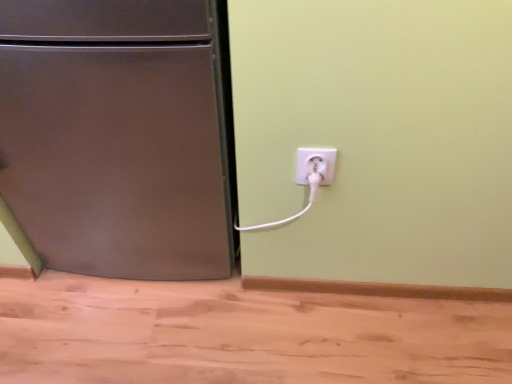
Question: In terms of size, does brushed metal refrigerator at left appear bigger or smaller than white plastic plug at lower right?

Choices:
 (A) small
 (B) big

Answer: (B)

Question: From the image's perspective, is brushed metal refrigerator at left above or below white plastic plug at lower right?

Choices:
 (A) below
 (B) above

Answer: (B)

Question: In terms of height, does brushed metal refrigerator at left look taller or shorter compared to white plastic plug at lower right?

Choices:
 (A) tall
 (B) short

Answer: (A)

Question: From a real-world perspective, is white plastic plug at lower right positioned above or below brushed metal refrigerator at left?

Choices:
 (A) above
 (B) below

Answer: (A)

Question: Considering the positions of point (306, 168) and point (226, 236), is point (306, 168) closer or farther from the camera than point (226, 236)?

Choices:
 (A) closer
 (B) farther

Answer: (A)

Question: Choose the correct answer: Is white plastic plug at lower right inside brushed metal refrigerator at left or outside it?

Choices:
 (A) inside
 (B) outside

Answer: (B)

Question: Is white plastic plug at lower right taller or shorter than brushed metal refrigerator at left?

Choices:
 (A) short
 (B) tall

Answer: (A)